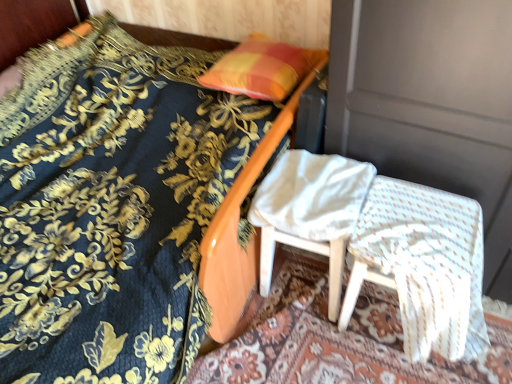
What do you see at coordinates (423, 266) in the screenshot? The image size is (512, 384). I see `white woven fabric chair at lower right, which is the second chair from left to right` at bounding box center [423, 266].

This screenshot has width=512, height=384. What do you see at coordinates (262, 68) in the screenshot?
I see `orange/yellow fabric pillow at upper center` at bounding box center [262, 68].

This screenshot has height=384, width=512. Describe the element at coordinates (112, 206) in the screenshot. I see `velvet blue bedspread at upper left` at that location.

Locate an element on the screen. white woven fabric chair at lower right, the 1th chair from the right is located at coordinates (423, 266).

Is white wood chair at center, which is counted as the first chair, starting from the left, inside or outside of white woven fabric chair at lower right, the 1th chair from the right?

white wood chair at center, which is counted as the first chair, starting from the left, exists outside the volume of white woven fabric chair at lower right, the 1th chair from the right.

Consider the image. Can you confirm if white wood chair at center, the second chair from the right, is bigger than white woven fabric chair at lower right, which is the second chair from left to right?

Incorrect, white wood chair at center, the second chair from the right, is not larger than white woven fabric chair at lower right, which is the second chair from left to right.

How far apart are white wood chair at center, the second chair from the right, and white woven fabric chair at lower right, which is the second chair from left to right?

white wood chair at center, the second chair from the right, and white woven fabric chair at lower right, which is the second chair from left to right, are 7.21 inches apart.

Is point (326, 202) in front of point (470, 325)?

Yes, point (326, 202) is closer to viewer.

Considering the points (385, 217) and (115, 349), which point is behind, point (385, 217) or point (115, 349)?

Positioned behind is point (385, 217).

Is velvet blue bedspread at upper left a part of white woven fabric chair at lower right, which is the second chair from left to right?

No, velvet blue bedspread at upper left is not a part of white woven fabric chair at lower right, which is the second chair from left to right.

What's the angular difference between white woven fabric chair at lower right, which is the second chair from left to right, and velvet blue bedspread at upper left's facing directions?

There is a 1.14-degree angle between the facing directions of white woven fabric chair at lower right, which is the second chair from left to right, and velvet blue bedspread at upper left.

Locate an element on the screen. pillow that is above the white wood chair at center, the second chair from the right (from a real-world perspective) is located at coordinates (262, 68).

Can you confirm if white wood chair at center, the second chair from the right, is positioned to the right of orange/yellow fabric pillow at upper center?

Yes, white wood chair at center, the second chair from the right, is to the right of orange/yellow fabric pillow at upper center.

Would you consider white wood chair at center, the second chair from the right, to be distant from orange/yellow fabric pillow at upper center?

No, white wood chair at center, the second chair from the right, is in close proximity to orange/yellow fabric pillow at upper center.

Is orange/yellow fabric pillow at upper center located within white wood chair at center, the second chair from the right?

That's incorrect, orange/yellow fabric pillow at upper center is not inside white wood chair at center, the second chair from the right.

Which is behind, white wood chair at center, which is counted as the first chair, starting from the left, or velvet blue bedspread at upper left?

white wood chair at center, which is counted as the first chair, starting from the left, is behind.

From the image's perspective, is white wood chair at center, the second chair from the right, above or below velvet blue bedspread at upper left?

From the image's perspective, white wood chair at center, the second chair from the right, appears below velvet blue bedspread at upper left.

Considering the sizes of white wood chair at center, the second chair from the right, and velvet blue bedspread at upper left in the image, is white wood chair at center, the second chair from the right, bigger or smaller than velvet blue bedspread at upper left?

Clearly, white wood chair at center, the second chair from the right, is smaller in size than velvet blue bedspread at upper left.

Considering the points (130, 176) and (460, 315), which point is behind, point (130, 176) or point (460, 315)?

The point (130, 176) is farther.

From the picture: Considering the relative positions of velvet blue bedspread at upper left and white woven fabric chair at lower right, which is the second chair from left to right, in the image provided, is velvet blue bedspread at upper left to the left or to the right of white woven fabric chair at lower right, which is the second chair from left to right,?

In the image, velvet blue bedspread at upper left appears on the left side of white woven fabric chair at lower right, which is the second chair from left to right.

Looking at this image, between velvet blue bedspread at upper left and white woven fabric chair at lower right, the 1th chair from the right, which one is positioned in front?

Positioned in front is velvet blue bedspread at upper left.

Which of these two, velvet blue bedspread at upper left or white woven fabric chair at lower right, the 1th chair from the right, is wider?

With larger width is velvet blue bedspread at upper left.

Is white wood chair at center, which is counted as the first chair, starting from the left, a part of velvet blue bedspread at upper left?

No, white wood chair at center, which is counted as the first chair, starting from the left, is not a part of velvet blue bedspread at upper left.

This screenshot has height=384, width=512. I want to click on bed located on the left of white wood chair at center, the second chair from the right, so click(112, 206).

From a real-world perspective, is velvet blue bedspread at upper left positioned over white wood chair at center, the second chair from the right, based on gravity?

Yes.

Is velvet blue bedspread at upper left to the left of white wood chair at center, the second chair from the right, from the viewer's perspective?

Indeed, velvet blue bedspread at upper left is positioned on the left side of white wood chair at center, the second chair from the right.

Does point (127, 267) lie behind point (247, 43)?

No, it is in front of (247, 43).

Looking at this image, is velvet blue bedspread at upper left shorter than orange/yellow fabric pillow at upper center?

In fact, velvet blue bedspread at upper left may be taller than orange/yellow fabric pillow at upper center.

In the scene shown: Does velvet blue bedspread at upper left have a greater width compared to orange/yellow fabric pillow at upper center?

Correct, the width of velvet blue bedspread at upper left exceeds that of orange/yellow fabric pillow at upper center.

You are a GUI agent. You are given a task and a screenshot of the screen. Output one action in this format:
    pyautogui.click(x=<x>, y=<y>)
    Task: Click on the chair on the left of white woven fabric chair at lower right, the 1th chair from the right
    The width and height of the screenshot is (512, 384).
    Given the screenshot: What is the action you would take?
    click(310, 211)

From the velvet blue bedspread at upper left, count 2nd chair to the right and point to it. Please provide its 2D coordinates.

[(423, 266)]

Which object lies further to the anchor point white woven fabric chair at lower right, the 1th chair from the right, orange/yellow fabric pillow at upper center or white wood chair at center, which is counted as the first chair, starting from the left?

orange/yellow fabric pillow at upper center.

When comparing their distances from orange/yellow fabric pillow at upper center, does white wood chair at center, which is counted as the first chair, starting from the left, or white woven fabric chair at lower right, the 1th chair from the right, seem closer?

Based on the image, white wood chair at center, which is counted as the first chair, starting from the left, appears to be nearer to orange/yellow fabric pillow at upper center.

Which object lies nearer to the anchor point velvet blue bedspread at upper left, white wood chair at center, the second chair from the right, or white woven fabric chair at lower right, the 1th chair from the right?

Among the two, white wood chair at center, the second chair from the right, is located nearer to velvet blue bedspread at upper left.

When comparing their distances from velvet blue bedspread at upper left, does white wood chair at center, the second chair from the right, or orange/yellow fabric pillow at upper center seem closer?

The object closer to velvet blue bedspread at upper left is orange/yellow fabric pillow at upper center.

Looking at the image, which one is located closer to white woven fabric chair at lower right, the 1th chair from the right, white wood chair at center, which is counted as the first chair, starting from the left, or orange/yellow fabric pillow at upper center?

white wood chair at center, which is counted as the first chair, starting from the left, is positioned closer to the anchor white woven fabric chair at lower right, the 1th chair from the right.

Considering their positions, is white woven fabric chair at lower right, the 1th chair from the right, positioned closer to white wood chair at center, which is counted as the first chair, starting from the left, than velvet blue bedspread at upper left?

white woven fabric chair at lower right, the 1th chair from the right.

From the image, which object appears to be nearer to velvet blue bedspread at upper left, white woven fabric chair at lower right, which is the second chair from left to right, or orange/yellow fabric pillow at upper center?

Based on the image, orange/yellow fabric pillow at upper center appears to be nearer to velvet blue bedspread at upper left.

Considering their positions, is velvet blue bedspread at upper left positioned closer to orange/yellow fabric pillow at upper center than white wood chair at center, the second chair from the right?

white wood chair at center, the second chair from the right.

Find the location of a particular element. This screenshot has width=512, height=384. pillow situated between velvet blue bedspread at upper left and white woven fabric chair at lower right, which is the second chair from left to right, from left to right is located at coordinates (262, 68).

Find the location of a particular element. This screenshot has height=384, width=512. chair between orange/yellow fabric pillow at upper center and white woven fabric chair at lower right, which is the second chair from left to right, in the up-down direction is located at coordinates (310, 211).

The image size is (512, 384). Find the location of `chair located between velvet blue bedspread at upper left and white woven fabric chair at lower right, which is the second chair from left to right, in the left-right direction`. chair located between velvet blue bedspread at upper left and white woven fabric chair at lower right, which is the second chair from left to right, in the left-right direction is located at coordinates (310, 211).

In order to click on pillow situated between velvet blue bedspread at upper left and white wood chair at center, the second chair from the right, from left to right in this screenshot , I will do `click(262, 68)`.